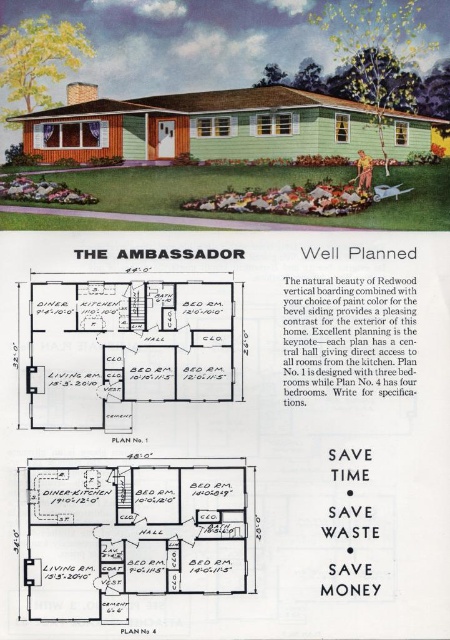
Can you confirm if matte green wall at lower center is bigger than white wood floor at center?

Indeed, matte green wall at lower center has a larger size compared to white wood floor at center.

In the scene shown: Can you confirm if matte green wall at lower center is taller than white wood floor at center?

No.

Identify the location of matte green wall at lower center. This screenshot has height=640, width=450. (131, 532).

The image size is (450, 640). Find the location of `matte green wall at lower center`. matte green wall at lower center is located at coordinates (131, 532).